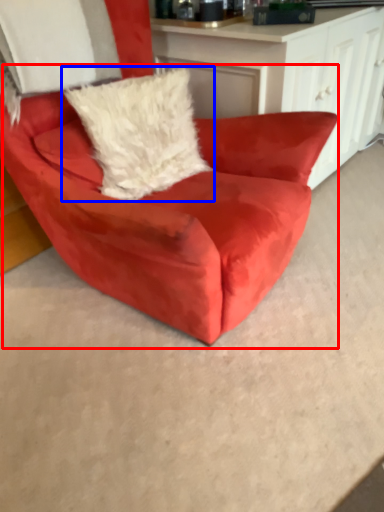
Question: Which object is further to the camera taking this photo, chair (highlighted by a red box) or pillow (highlighted by a blue box)?

Choices:
 (A) chair
 (B) pillow

Answer: (B)